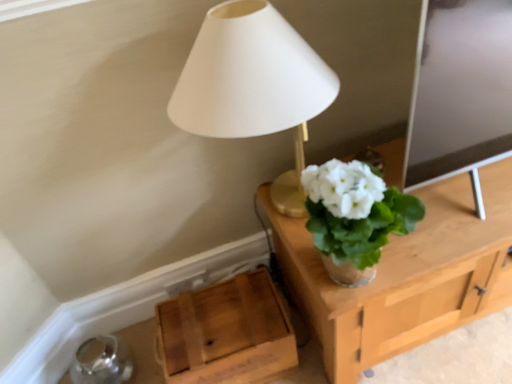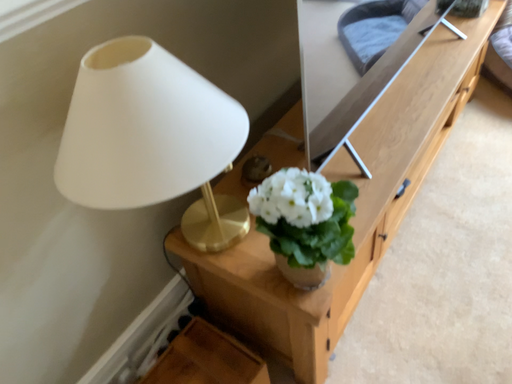
Question: Which way did the camera rotate in the video?

Choices:
 (A) rotated upward
 (B) rotated downward

Answer: (A)